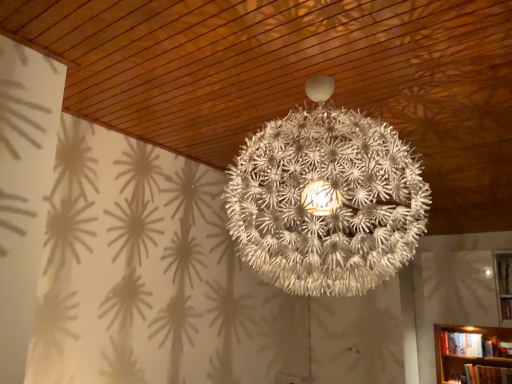
What do you see at coordinates (481, 375) in the screenshot?
I see `hardcover book at lower right` at bounding box center [481, 375].

This screenshot has width=512, height=384. What are the coordinates of `hardcover book at lower right` in the screenshot? It's located at (481, 375).

This screenshot has height=384, width=512. I want to click on white matte spherical lamp at center, so click(326, 200).

Describe the element at coordinates (326, 200) in the screenshot. I see `white matte spherical lamp at center` at that location.

Find the location of `hardcover book at lower right`. hardcover book at lower right is located at coordinates (481, 375).

Between white matte spherical lamp at center and hardcover book at lower right, which one appears on the right side from the viewer's perspective?

Positioned to the right is hardcover book at lower right.

Which object is closer to the camera, white matte spherical lamp at center or hardcover book at lower right?

white matte spherical lamp at center is more forward.

Considering the positions of points (300, 255) and (496, 376), is point (300, 255) farther from camera compared to point (496, 376)?

No.

From the image's perspective, relative to hardcover book at lower right, is white matte spherical lamp at center above or below?

From the image's perspective, white matte spherical lamp at center appears above hardcover book at lower right.

From a real-world perspective, is white matte spherical lamp at center below hardcover book at lower right?

No.

Considering the sizes of objects white matte spherical lamp at center and hardcover book at lower right in the image provided, who is thinner, white matte spherical lamp at center or hardcover book at lower right?

hardcover book at lower right.

Can you confirm if white matte spherical lamp at center is shorter than hardcover book at lower right?

In fact, white matte spherical lamp at center may be taller than hardcover book at lower right.

Considering the relative sizes of white matte spherical lamp at center and hardcover book at lower right in the image provided, is white matte spherical lamp at center smaller than hardcover book at lower right?

Actually, white matte spherical lamp at center might be larger than hardcover book at lower right.

Is white matte spherical lamp at center completely or partially outside of hardcover book at lower right?

white matte spherical lamp at center is positioned outside hardcover book at lower right.

Are white matte spherical lamp at center and hardcover book at lower right making contact?

They are not placed beside each other.

Is white matte spherical lamp at center positioned with its back to hardcover book at lower right?

Correct, white matte spherical lamp at center is looking away from hardcover book at lower right.

How many degrees apart are the facing directions of white matte spherical lamp at center and hardcover book at lower right?

white matte spherical lamp at center and hardcover book at lower right are facing 0.0863 degrees away from each other.

Find the location of a particular element. lamp that is above the hardcover book at lower right (from a real-world perspective) is located at coordinates (326, 200).

Between hardcover book at lower right and white matte spherical lamp at center, which one appears on the left side from the viewer's perspective?

Positioned to the left is white matte spherical lamp at center.

In the image, is hardcover book at lower right positioned in front of or behind white matte spherical lamp at center?

In the image, hardcover book at lower right appears behind white matte spherical lamp at center.

Between point (449, 379) and point (370, 164), which one is positioned behind?

The point (449, 379) is behind.

From the picture: From the image's perspective, which is above, hardcover book at lower right or white matte spherical lamp at center?

white matte spherical lamp at center is shown above in the image.

From a real-world perspective, is hardcover book at lower right beneath white matte spherical lamp at center?

Yes, from a real-world perspective, hardcover book at lower right is under white matte spherical lamp at center.

Which object is wider, hardcover book at lower right or white matte spherical lamp at center?

white matte spherical lamp at center is wider.

Is hardcover book at lower right taller or shorter than white matte spherical lamp at center?

In the image, hardcover book at lower right appears to be shorter than white matte spherical lamp at center.

Considering the relative sizes of hardcover book at lower right and white matte spherical lamp at center in the image provided, is hardcover book at lower right bigger than white matte spherical lamp at center?

Actually, hardcover book at lower right might be smaller than white matte spherical lamp at center.

Would you say white matte spherical lamp at center is part of hardcover book at lower right's contents?

No, white matte spherical lamp at center is not a part of hardcover book at lower right.

Is hardcover book at lower right next to white matte spherical lamp at center and touching it?

hardcover book at lower right and white matte spherical lamp at center are not in contact.

Could you tell me if hardcover book at lower right is facing white matte spherical lamp at center?

No, hardcover book at lower right does not turn towards white matte spherical lamp at center.

The height and width of the screenshot is (384, 512). Find the location of `book behind the white matte spherical lamp at center`. book behind the white matte spherical lamp at center is located at coordinates (481, 375).

Where is `lamp to the left of hardcover book at lower right`? The width and height of the screenshot is (512, 384). lamp to the left of hardcover book at lower right is located at coordinates (326, 200).

Where is `book behind the white matte spherical lamp at center`? book behind the white matte spherical lamp at center is located at coordinates (481, 375).